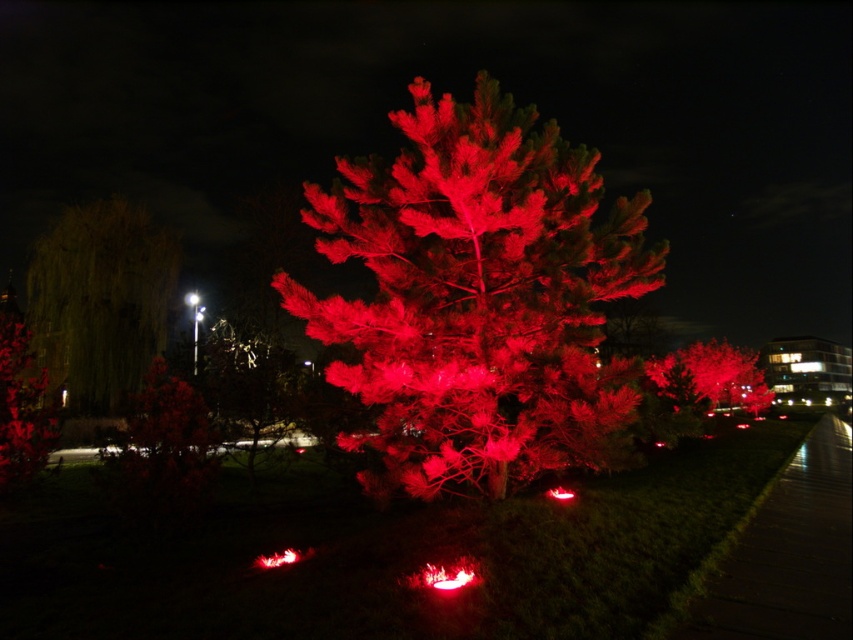
You are standing at the origin point in the image. Where is the shiny metallic sculpture at center located in terms of coordinates?

The shiny metallic sculpture at center is located at coordinates point (251, 392).

Based on the photo, you are a photographer setting up a tripod in this scene. You want to capture both the smooth bark willow at left and the glossy red tree at left in a single shot. Which tree should you focus on first to ensure both are in frame?

The smooth bark willow at left is much taller than the glossy red tree at left, so focusing on the taller smooth bark willow at left first will help ensure both are in frame.